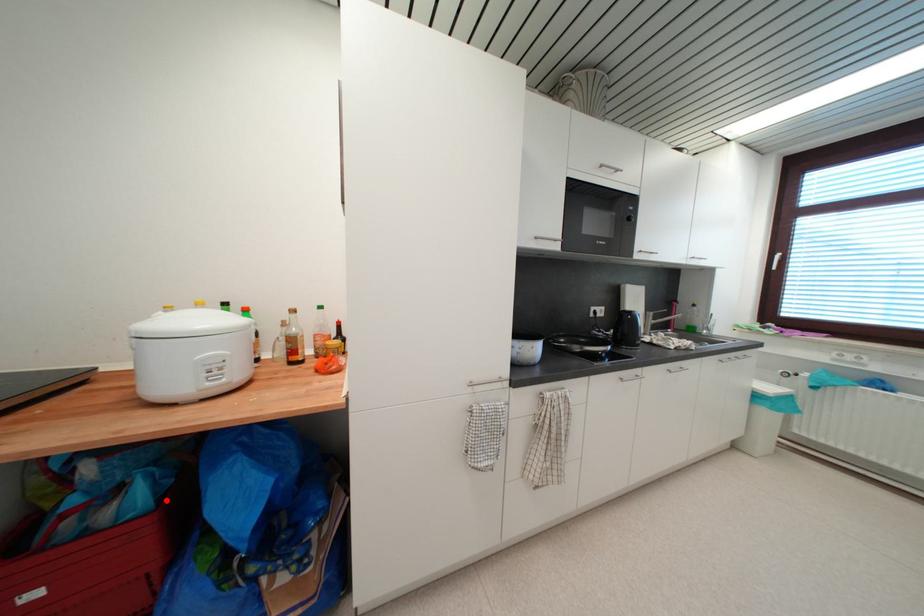
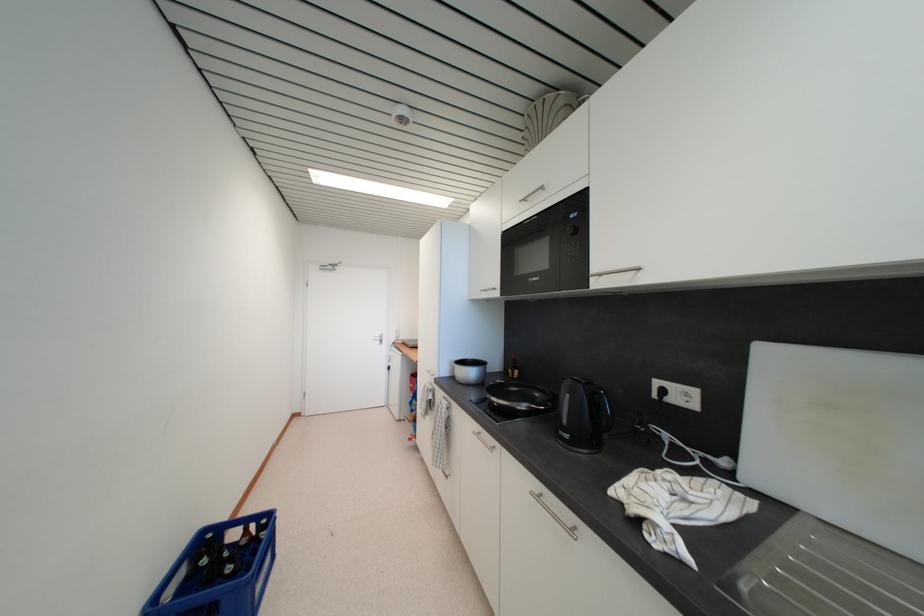
Question: I am providing you with two images of the same scene from different viewpoints. A red point is marked on the first image. Can you still see the location of the red point in image 2?

Choices:
 (A) Yes
 (B) No

Answer: (B)